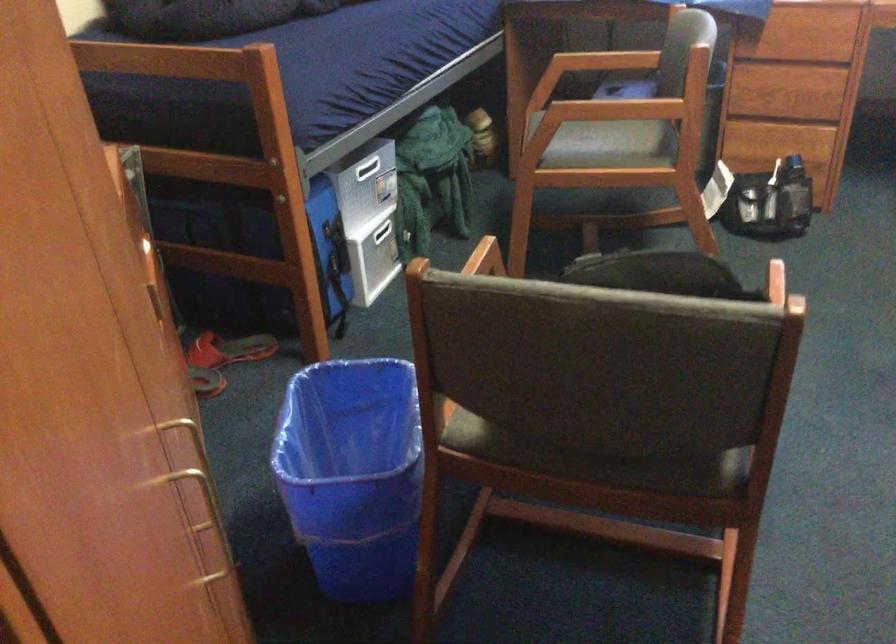
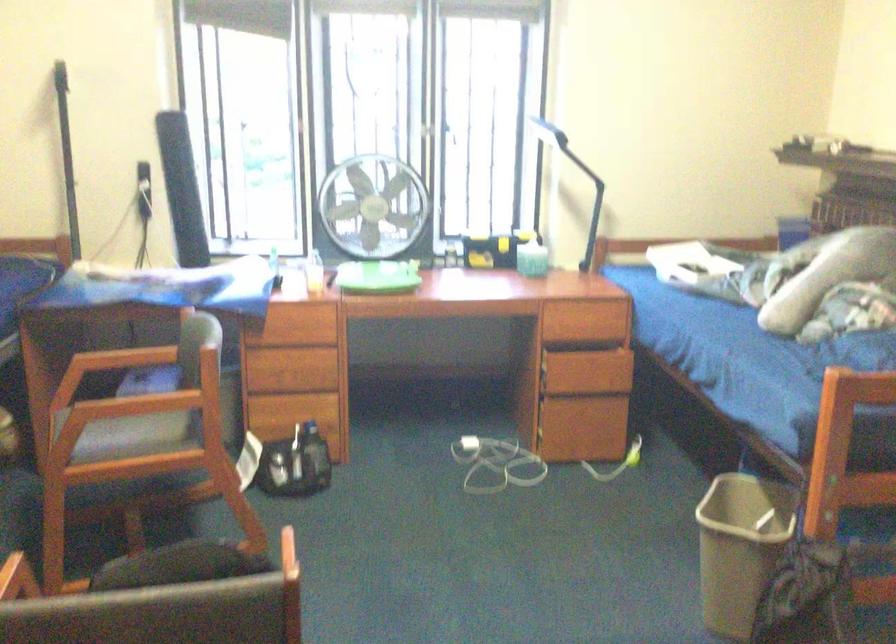
Find the pixel in the second image that matches (x=800, y=194) in the first image.

(314, 457)